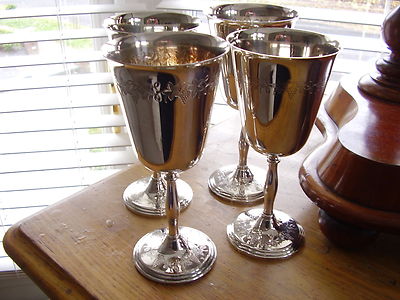
In order to click on fancy window blinds, wood in this screenshot , I will do `click(43, 81)`, `click(341, 62)`, `click(355, 39)`, `click(356, 22)`, `click(42, 25)`.